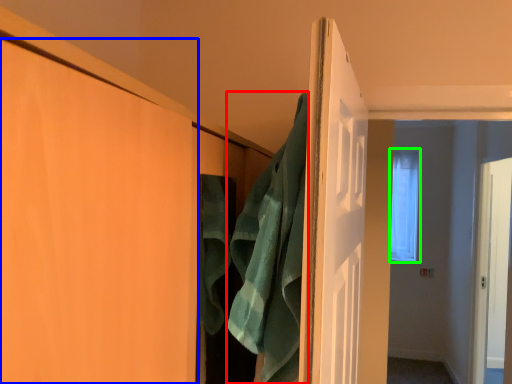
Question: Which is farther away from bath towel (highlighted by a red box)? door (highlighted by a blue box) or window (highlighted by a green box)?

Choices:
 (A) door
 (B) window

Answer: (B)